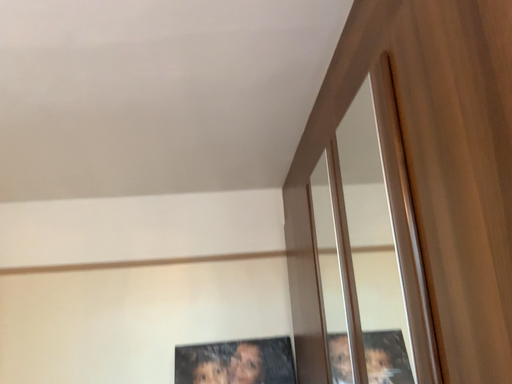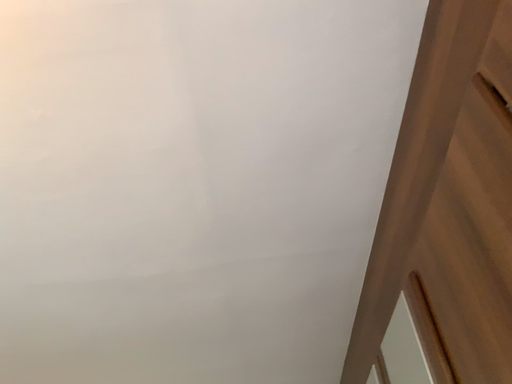
Question: How did the camera likely rotate when shooting the video?

Choices:
 (A) rotated downward
 (B) rotated upward

Answer: (B)